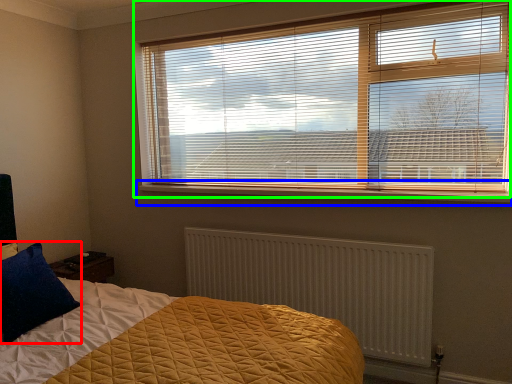
Question: Which object is positioned closest to pillow (highlighted by a red box)? Select from window sill (highlighted by a blue box) and window blind (highlighted by a green box).

Choices:
 (A) window sill
 (B) window blind

Answer: (A)